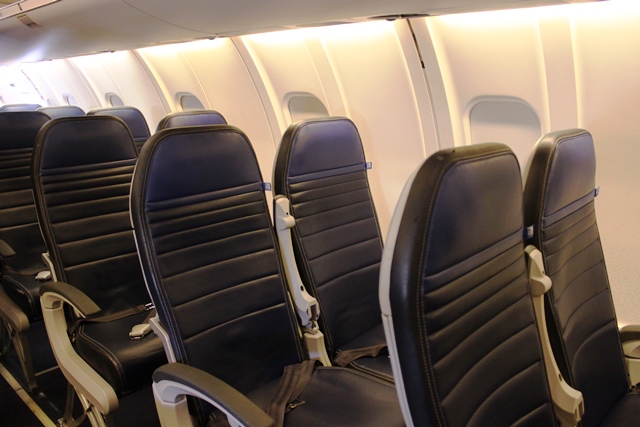
What are the coordinates of `seat headrests` in the screenshot? It's located at (22, 108), (67, 111), (13, 127), (129, 112), (88, 134), (203, 116), (219, 148), (328, 143), (472, 183), (573, 164).